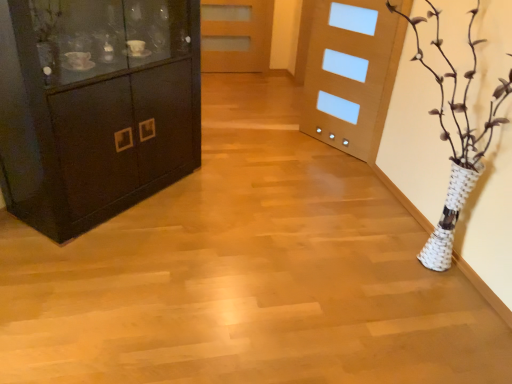
Question: Considering the relative positions of matte wood door at center and matte black cabinet at left in the image provided, is matte wood door at center to the left of matte black cabinet at left from the viewer's perspective?

Choices:
 (A) yes
 (B) no

Answer: (B)

Question: Does matte wood door at center have a greater height compared to matte black cabinet at left?

Choices:
 (A) yes
 (B) no

Answer: (B)

Question: From a real-world perspective, is matte wood door at center over matte black cabinet at left?

Choices:
 (A) no
 (B) yes

Answer: (A)

Question: Is matte wood door at center placed right next to matte black cabinet at left?

Choices:
 (A) yes
 (B) no

Answer: (B)

Question: Are matte wood door at center and matte black cabinet at left located far from each other?

Choices:
 (A) yes
 (B) no

Answer: (A)

Question: Can you confirm if matte wood door at center is positioned to the right of matte black cabinet at left?

Choices:
 (A) no
 (B) yes

Answer: (B)

Question: From a real-world perspective, is matte black cabinet at left below matte wood door at center?

Choices:
 (A) yes
 (B) no

Answer: (B)

Question: Is matte black cabinet at left further to camera compared to matte wood door at center?

Choices:
 (A) yes
 (B) no

Answer: (B)

Question: Does matte black cabinet at left lie in front of matte wood door at center?

Choices:
 (A) no
 (B) yes

Answer: (B)

Question: From the image's perspective, is matte black cabinet at left above matte wood door at center?

Choices:
 (A) yes
 (B) no

Answer: (B)

Question: Does matte black cabinet at left appear on the right side of matte wood door at center?

Choices:
 (A) yes
 (B) no

Answer: (B)

Question: Is matte black cabinet at left wider than matte wood door at center?

Choices:
 (A) no
 (B) yes

Answer: (B)

Question: Is matte wood door at center inside or outside of matte black cabinet at left?

Choices:
 (A) inside
 (B) outside

Answer: (B)